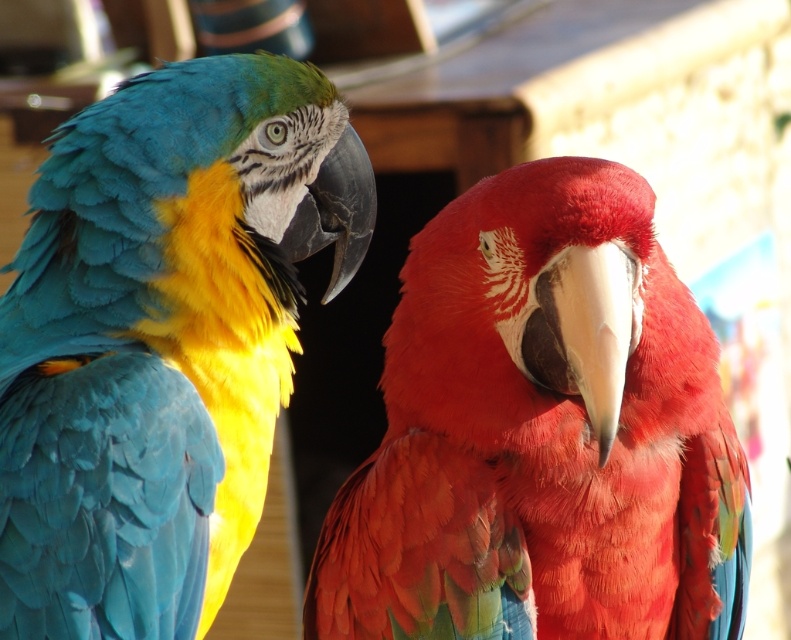
Question: Which point appears farthest from the camera in this image?

Choices:
 (A) (460, 512)
 (B) (108, 189)

Answer: (B)

Question: Which object is closer to the camera taking this photo?

Choices:
 (A) shiny blue feathers at left
 (B) shiny red parrot at center

Answer: (B)

Question: Is shiny red parrot at center to the right of shiny blue feathers at left from the viewer's perspective?

Choices:
 (A) no
 (B) yes

Answer: (B)

Question: Is shiny red parrot at center wider than shiny blue feathers at left?

Choices:
 (A) yes
 (B) no

Answer: (A)

Question: Does shiny red parrot at center have a lesser width compared to shiny blue feathers at left?

Choices:
 (A) no
 (B) yes

Answer: (A)

Question: Among these points, which one is farthest from the camera?

Choices:
 (A) (672, 476)
 (B) (245, 218)

Answer: (B)